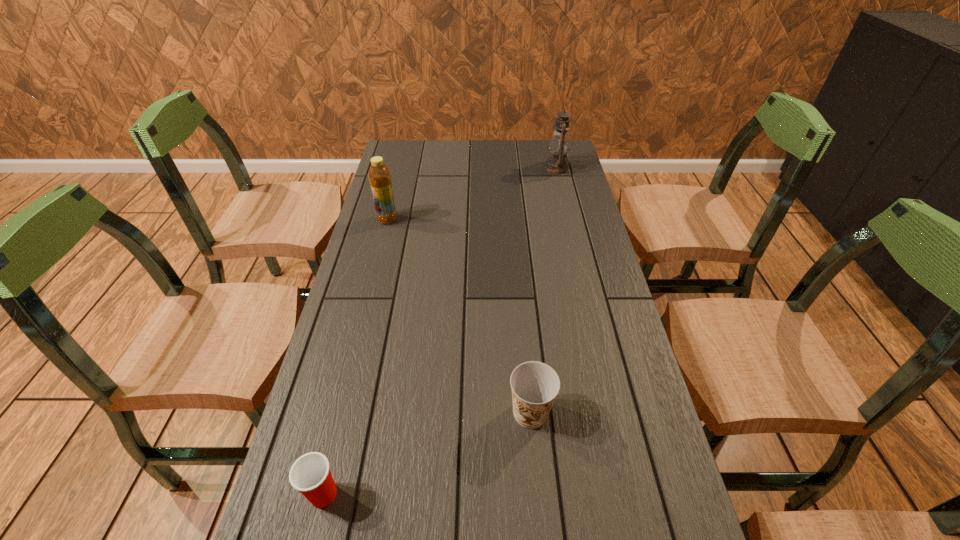
The image size is (960, 540). What are the coordinates of `free region at the far left corner of the desktop` in the screenshot? It's located at (394, 148).

Identify the location of vacant space at the far right corner. (534, 143).

This screenshot has height=540, width=960. I want to click on free spot between the rightmost object and the right Dixie cup, so pos(543,291).

This screenshot has height=540, width=960. In order to click on blank region between the nearest object and the third nearest object in this screenshot , I will do `click(355, 357)`.

Image resolution: width=960 pixels, height=540 pixels. In order to click on vacant area that lies between the rightmost object and the farther Dixie cup in this screenshot , I will do `click(543, 291)`.

Locate an element on the screen. This screenshot has width=960, height=540. unoccupied position between the tallest object and the second farthest object is located at coordinates (472, 194).

Where is `vacant space in between the oil lamp and the third farthest object`? vacant space in between the oil lamp and the third farthest object is located at coordinates (543, 291).

This screenshot has height=540, width=960. Identify the location of free space between the nearest object and the bottle. (355, 357).

Find the location of a particular element. vacant space that's between the right Dixie cup and the farthest object is located at coordinates (543, 291).

Find the location of a particular element. vacant area between the nearer Dixie cup and the third nearest object is located at coordinates (355, 357).